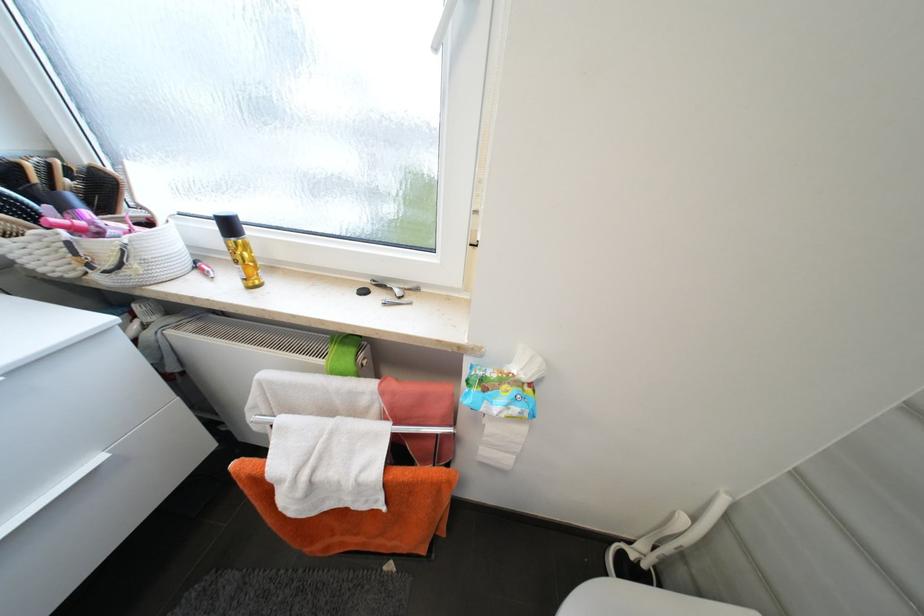
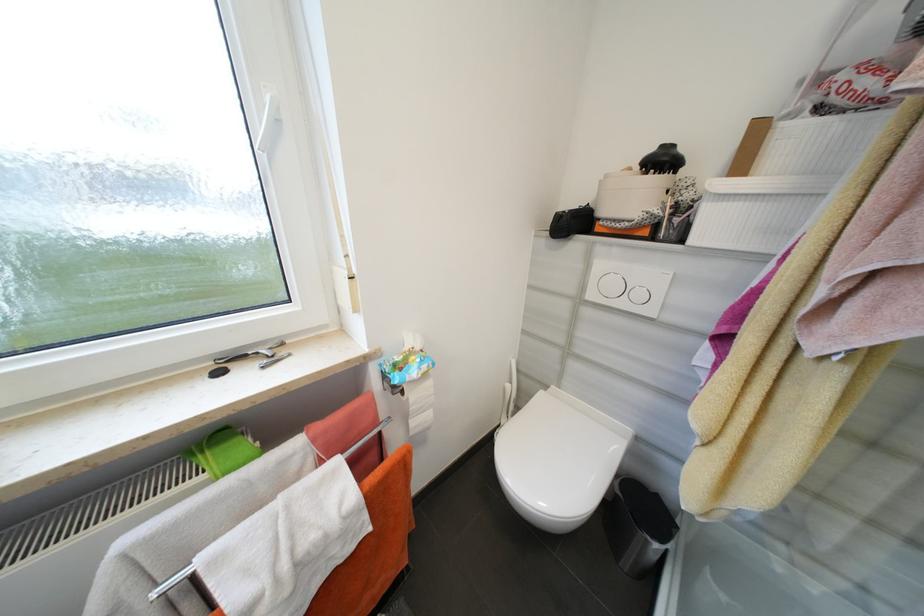
In the second image, find the point that corresponds to [521,411] in the first image.

(430, 368)